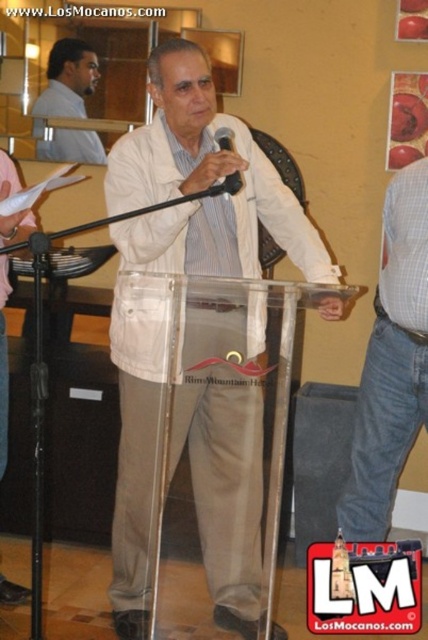
Looking at this image, you are an event organizer who needs to ensure all attire elements are visible to the camera. The camera is positioned to capture both the denim jeans at right and the matte white shirt at upper left. Which attire element is more likely to be fully visible in the camera frame?

The denim jeans at right is taller than the matte white shirt at upper left, so the denim jeans at right is more likely to be fully visible in the camera frame since it occupies a larger portion of the frame.

You are a photographer setting up for an event. You need to ensure that the denim jeans at right and the black matte microphone at center are both visible in your shot. Considering their sizes, which object should you focus on first to ensure proper framing?

Answer: The denim jeans at right is bigger than the black matte microphone at center, so you should focus on framing the denim jeans at right first to accommodate its larger size in the composition.

You are standing in a conference room and see the point marked at coordinates point (x=140, y=637). If you want to reach that point quickly, should you move forward or backward?

The point (x=140, y=637) is 2.49 meters away from the viewer, so you should move forward to reach it quickly.